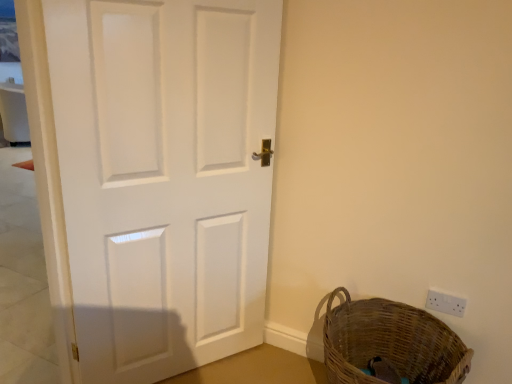
Describe the element at coordinates (390, 342) in the screenshot. I see `woven brown basket at lower right` at that location.

The height and width of the screenshot is (384, 512). Identify the location of white matte door at center. (164, 177).

Which of these two, white matte door at center or woven brown basket at lower right, is thinner?

white matte door at center is thinner.

Is white matte door at center facing towards woven brown basket at lower right?

Yes, white matte door at center is turned towards woven brown basket at lower right.

Is the depth of white matte door at center less than that of woven brown basket at lower right?

Yes, white matte door at center is closer to the camera.

How many degrees apart are the facing directions of white matte door at center and woven brown basket at lower right?

There is a 56.9-degree angle between the facing directions of white matte door at center and woven brown basket at lower right.

Is white plastic electric outlet at lower right to the left or to the right of white matte door at center in the image?

From the image, it's evident that white plastic electric outlet at lower right is to the right of white matte door at center.

Would you say white matte door at center is part of white plastic electric outlet at lower right's contents?

No, white matte door at center is located outside of white plastic electric outlet at lower right.

How different are the orientations of white plastic electric outlet at lower right and white matte door at center in degrees?

The angular difference between white plastic electric outlet at lower right and white matte door at center is 57.1 degrees.

From the picture: From a real-world perspective, is white plastic electric outlet at lower right positioned above or below white matte door at center?

From a real-world perspective, white plastic electric outlet at lower right is physically below white matte door at center.

In the image, is woven brown basket at lower right positioned in front of or behind white plastic electric outlet at lower right?

In the image, woven brown basket at lower right appears in front of white plastic electric outlet at lower right.

From the image's perspective, relative to white plastic electric outlet at lower right, is woven brown basket at lower right above or below?

woven brown basket at lower right is below white plastic electric outlet at lower right.

Is woven brown basket at lower right wider or thinner than white plastic electric outlet at lower right?

Considering their sizes, woven brown basket at lower right looks broader than white plastic electric outlet at lower right.

How different are the orientations of woven brown basket at lower right and white plastic electric outlet at lower right in degrees?

The angle between the facing direction of woven brown basket at lower right and the facing direction of white plastic electric outlet at lower right is 0.204 degrees.

From the image's perspective, does white matte door at center appear higher than white plastic electric outlet at lower right?

Yes, from the image's perspective, white matte door at center is over white plastic electric outlet at lower right.

Is white matte door at center not near white plastic electric outlet at lower right?

Indeed, white matte door at center is not near white plastic electric outlet at lower right.

Is white matte door at center shorter than white plastic electric outlet at lower right?

In fact, white matte door at center may be taller than white plastic electric outlet at lower right.

Can you confirm if white matte door at center is thinner than white plastic electric outlet at lower right?

In fact, white matte door at center might be wider than white plastic electric outlet at lower right.

Considering the sizes of white plastic electric outlet at lower right and woven brown basket at lower right in the image, is white plastic electric outlet at lower right bigger or smaller than woven brown basket at lower right?

white plastic electric outlet at lower right is smaller than woven brown basket at lower right.

From the image's perspective, between white plastic electric outlet at lower right and woven brown basket at lower right, who is located below?

woven brown basket at lower right appears lower in the image.

Is white plastic electric outlet at lower right surrounding woven brown basket at lower right?

No, woven brown basket at lower right is not a part of white plastic electric outlet at lower right.

At what (x,y) coordinates should I click in order to perform the action: click on basket lying below the white plastic electric outlet at lower right (from the image's perspective). Please return your answer as a coordinate pair (x, y). The image size is (512, 384). Looking at the image, I should click on (390, 342).

Is woven brown basket at lower right facing towards white matte door at center?

No, woven brown basket at lower right is not oriented towards white matte door at center.

In the image, is woven brown basket at lower right positioned in front of or behind white matte door at center?

In the image, woven brown basket at lower right appears behind white matte door at center.

From the image's perspective, does woven brown basket at lower right appear higher than white matte door at center?

No, from the image's perspective, woven brown basket at lower right is not over white matte door at center.

Is woven brown basket at lower right next to white matte door at center?

No, woven brown basket at lower right is not in contact with white matte door at center.

I want to click on door positioned vertically above the woven brown basket at lower right (from a real-world perspective), so click(x=164, y=177).

The image size is (512, 384). I want to click on electric outlet below the white matte door at center (from the image's perspective), so click(445, 303).

Which object lies nearer to the anchor point white matte door at center, woven brown basket at lower right or white plastic electric outlet at lower right?

woven brown basket at lower right.

Considering their positions, is white matte door at center positioned closer to white plastic electric outlet at lower right than woven brown basket at lower right?

Among the two, woven brown basket at lower right is located nearer to white plastic electric outlet at lower right.

Considering their positions, is woven brown basket at lower right positioned further to white plastic electric outlet at lower right than white matte door at center?

white matte door at center is further to white plastic electric outlet at lower right.

When comparing their distances from woven brown basket at lower right, does white plastic electric outlet at lower right or white matte door at center seem closer?

white plastic electric outlet at lower right is positioned closer to the anchor woven brown basket at lower right.

Looking at the image, which one is located further to white matte door at center, white plastic electric outlet at lower right or woven brown basket at lower right?

Based on the image, white plastic electric outlet at lower right appears to be further to white matte door at center.

From the image, which object appears to be farther from woven brown basket at lower right, white matte door at center or white plastic electric outlet at lower right?

Based on the image, white matte door at center appears to be further to woven brown basket at lower right.

Identify the location of basket situated between white matte door at center and white plastic electric outlet at lower right from left to right. (390, 342).